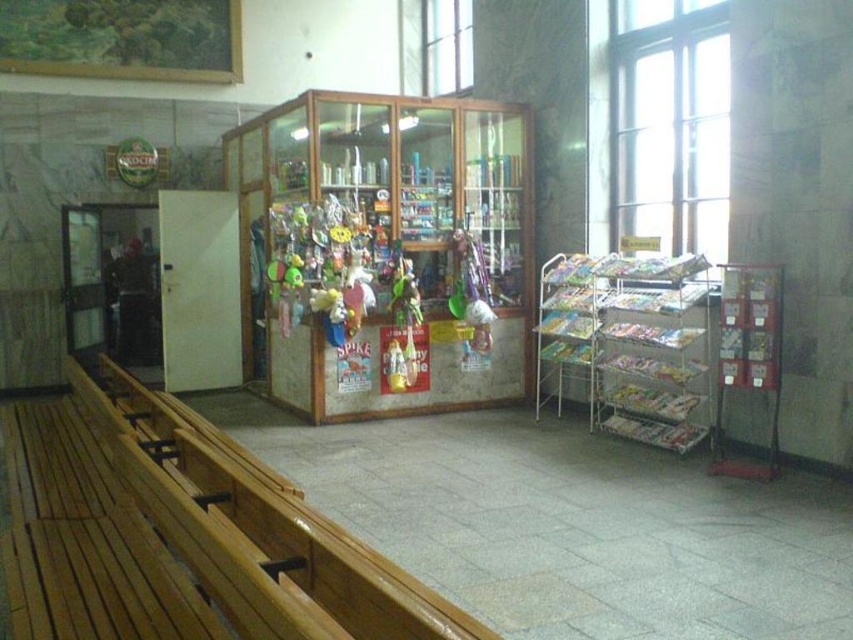
You are standing at the entrance of the train station and want to take a photo of the glass display case filled with souvenirs. The display case is located at point (61, 502). If your camera has a maximum focus range of 10 feet, will you be able to capture a clear photo of the display case from your current position?

The distance of point (61, 502) from the camera is 11.09 feet, which exceeds the camera maximum focus range of 10 feet. Therefore, you cannot capture a clear photo of the display case from your current position.

You are a visitor in this public space and want to place the shiny plastic action figure at center on top of the wooden bench at left. Considering their sizes, will the action figure fit on the bench without falling off?

The wooden bench at left is bigger than the shiny plastic action figure at center, so the action figure will fit on the bench without falling off.